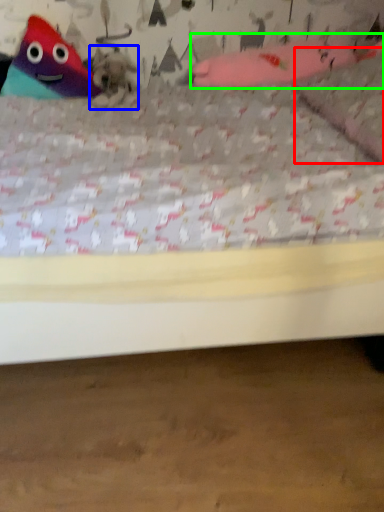
Question: Based on their relative distances, which object is farther from pillow (highlighted by a red box)? Choose from animal (highlighted by a blue box) and toy (highlighted by a green box).

Choices:
 (A) animal
 (B) toy

Answer: (A)